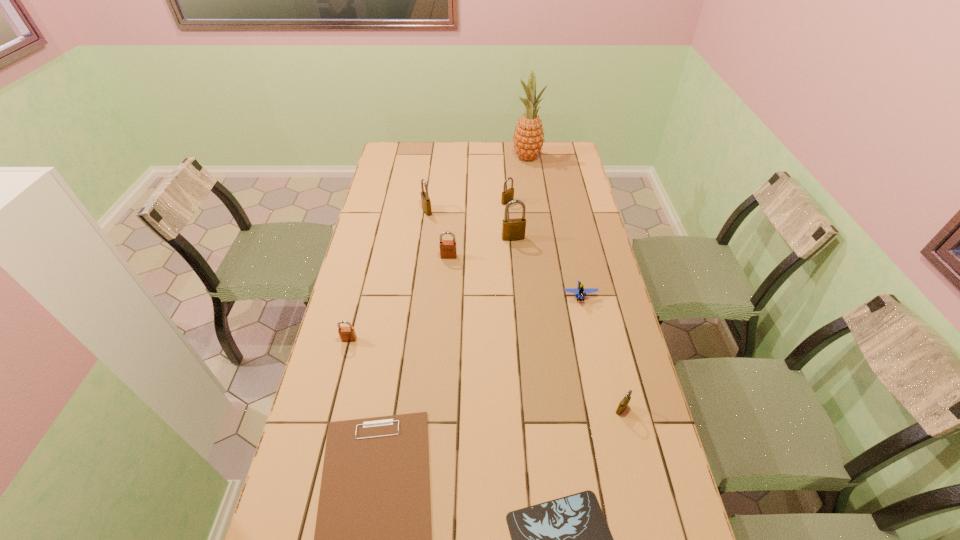
Identify the location of the smallest brass padlock. The image size is (960, 540). (624, 402).

Image resolution: width=960 pixels, height=540 pixels. What are the coordinates of `the nearest padlock` in the screenshot? It's located at (624, 402).

In order to click on the fifth farthest padlock in this screenshot , I will do click(x=347, y=334).

Where is `the smaller brown padlock`? This screenshot has width=960, height=540. the smaller brown padlock is located at coordinates tap(347, 334).

Locate an element on the screen. the sixth farthest object is located at coordinates (580, 292).

You are a GUI agent. You are given a task and a screenshot of the screen. Output one action in this format:
    pyautogui.click(x=<x>, y=<y>)
    Task: Click on the third shortest object
    
    Given the screenshot: What is the action you would take?
    pyautogui.click(x=580, y=292)

You are a GUI agent. You are given a task and a screenshot of the screen. Output one action in this format:
    pyautogui.click(x=<x>, y=<y>)
    Task: Click on the vacant space situated on the left of the tallest object
    The height and width of the screenshot is (540, 960).
    Given the screenshot: What is the action you would take?
    pyautogui.click(x=439, y=157)

Find the location of a particular element. free point located on the left of the tallest padlock is located at coordinates (455, 238).

Locate an element on the screen. This screenshot has width=960, height=540. free region located on the back of the second tallest padlock is located at coordinates (429, 195).

The width and height of the screenshot is (960, 540). Find the location of `vacant area situated 0.140m on the front-facing side of the fourth padlock from right to left`. vacant area situated 0.140m on the front-facing side of the fourth padlock from right to left is located at coordinates (446, 287).